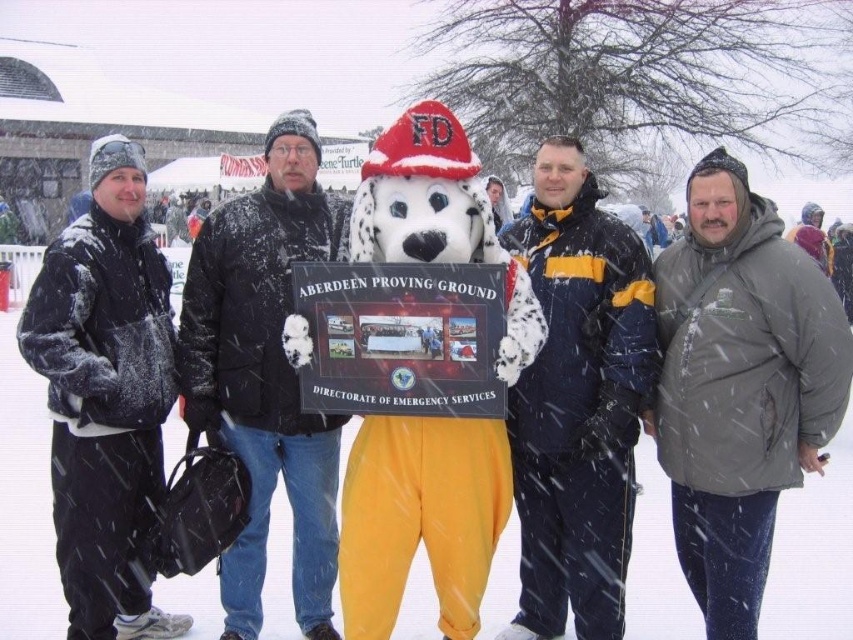
You are trying to identify clothing based on height in the snowy scene. Which of the two jackets, the gray fuzzy jacket at right or the matte black jacket at center, reaches a lower point on the person?

The gray fuzzy jacket at right is shorter than the matte black jacket at center, so it reaches a lower point on the person.